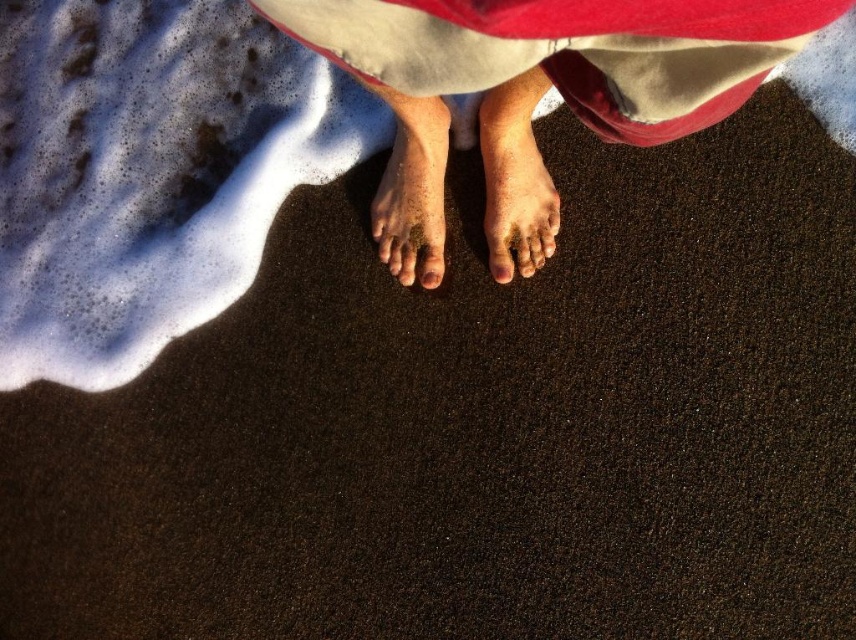
You are a photographer aiming to capture the smooth skin feet at center in focus while keeping the surrounding waves and sand in the background blurred. Given that the camera has a depth of field of 10 inches, will the subject be in focus?

The smooth skin feet at center is 19.29 inches from the camera, which is outside the camera depth of field of 10 inches. Therefore, the subject will not be in focus.